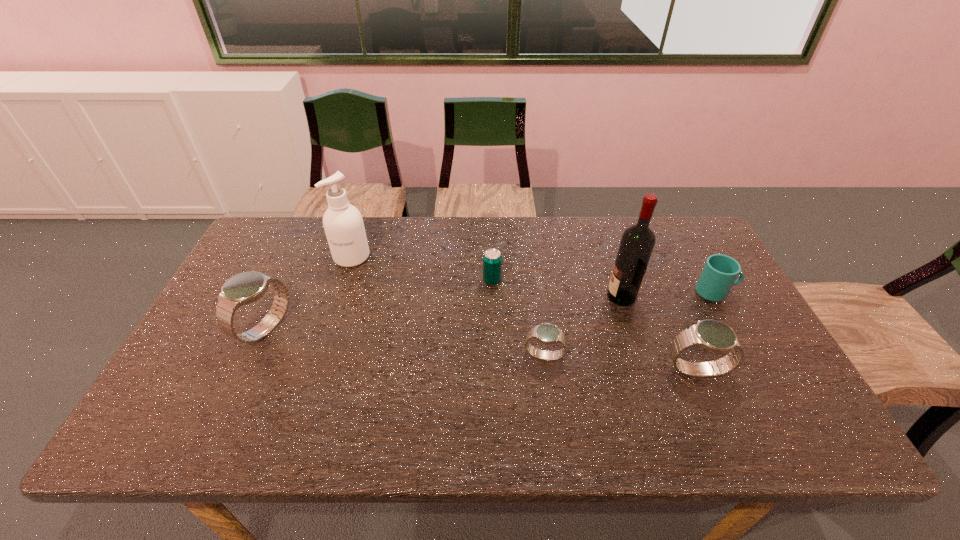
Locate an element on the screen. The width and height of the screenshot is (960, 540). object that is positioned at the left edge is located at coordinates click(x=244, y=288).

You are a GUI agent. You are given a task and a screenshot of the screen. Output one action in this format:
    pyautogui.click(x=<x>, y=<y>)
    Task: Click on the watch positioned at the right edge
    
    Given the screenshot: What is the action you would take?
    pyautogui.click(x=712, y=335)

Locate an element on the screen. cup present at the right edge is located at coordinates (719, 274).

Find the location of `object present at the near right corner`. object present at the near right corner is located at coordinates (712, 335).

Locate an element on the screen. The height and width of the screenshot is (540, 960). free space at the far edge of the desktop is located at coordinates (448, 260).

Image resolution: width=960 pixels, height=540 pixels. Identify the location of free region at the near edge of the desktop. click(x=409, y=390).

In the image, there is a desktop. Identify the location of vacant space at the left edge. (243, 320).

The width and height of the screenshot is (960, 540). What are the coordinates of `blank space at the right edge of the desktop` in the screenshot? It's located at (743, 348).

Image resolution: width=960 pixels, height=540 pixels. Find the location of `free region at the far left corner of the desktop`. free region at the far left corner of the desktop is located at coordinates (263, 232).

Locate an element on the screen. vacant space at the far right corner of the desktop is located at coordinates (684, 241).